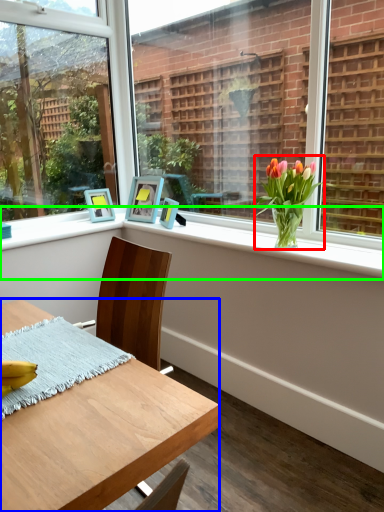
Question: Which object is positioned farthest from houseplant (highlighted by a red box)? Select from desk (highlighted by a blue box) and window sill (highlighted by a green box).

Choices:
 (A) desk
 (B) window sill

Answer: (A)